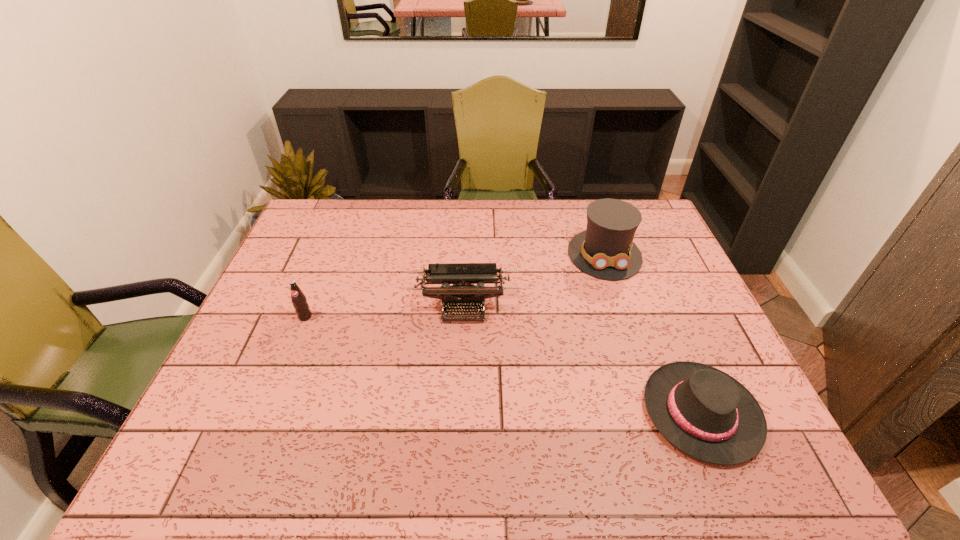
The height and width of the screenshot is (540, 960). I want to click on vacant point at the near left corner, so click(229, 468).

You are a GUI agent. You are given a task and a screenshot of the screen. Output one action in this format:
    pyautogui.click(x=<x>, y=<y>)
    Task: Click on the empty space between the farther dress hat and the shortest object
    The height and width of the screenshot is (540, 960).
    Given the screenshot: What is the action you would take?
    pyautogui.click(x=653, y=334)

This screenshot has height=540, width=960. I want to click on free space between the shortest object and the tallest object, so click(653, 334).

Identify the location of empty space that is in between the nearer dress hat and the second object from left to right. The image size is (960, 540). (583, 359).

You are a GUI agent. You are given a task and a screenshot of the screen. Output one action in this format:
    pyautogui.click(x=<x>, y=<y>)
    Task: Click on the free space between the second object from left to right and the third shortest object
    This screenshot has height=540, width=960.
    Given the screenshot: What is the action you would take?
    point(384,312)

Where is `empty space that is in between the nearest object and the farther dress hat`? This screenshot has width=960, height=540. empty space that is in between the nearest object and the farther dress hat is located at coordinates (653, 334).

Where is `blank region between the taller dress hat and the shortest object`? The image size is (960, 540). blank region between the taller dress hat and the shortest object is located at coordinates (653, 334).

You are a GUI agent. You are given a task and a screenshot of the screen. Output one action in this format:
    pyautogui.click(x=<x>, y=<y>)
    Task: Click on the free space between the leftmost object and the typewriter
    The width and height of the screenshot is (960, 540).
    Given the screenshot: What is the action you would take?
    pyautogui.click(x=384, y=312)

This screenshot has height=540, width=960. What are the coordinates of `unoccupied position between the third object from right to left and the taller dress hat` in the screenshot? It's located at (534, 280).

The height and width of the screenshot is (540, 960). I want to click on object that ranks as the second closest to the second object from left to right, so click(x=299, y=300).